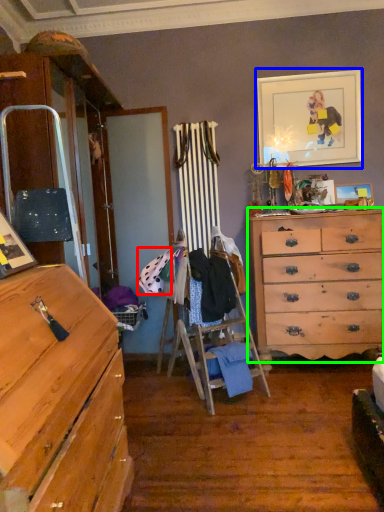
Question: Which is farther away from clothing (highlighted by a red box)? picture frame (highlighted by a blue box) or chest of drawers (highlighted by a green box)?

Choices:
 (A) picture frame
 (B) chest of drawers

Answer: (A)